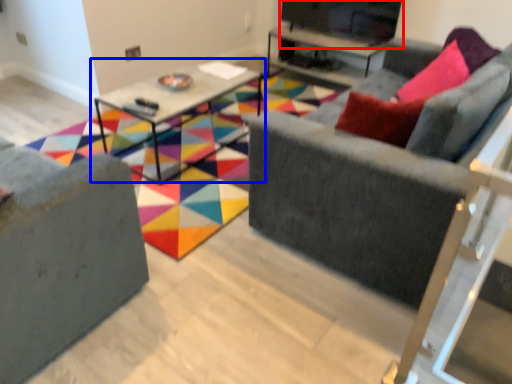
Question: Which object appears farthest to the camera in this image, entertainment center (highlighted by a red box) or table (highlighted by a blue box)?

Choices:
 (A) entertainment center
 (B) table

Answer: (A)